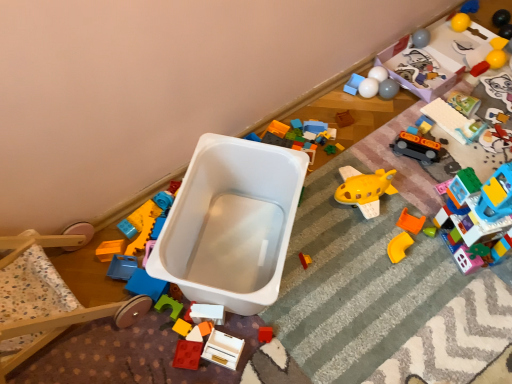
Question: From the image's perspective, is white plastic toy at center, the 14th toy when ordered from right to left, over rubberized plastic toy car at upper right, marked as the 4th toy in a right-to-left arrangement?

Choices:
 (A) yes
 (B) no

Answer: (B)

Question: Is white plastic toy at center, the 14th toy when ordered from right to left, shorter than rubberized plastic toy car at upper right, which appears as the thirteenth toy when viewed from the left?

Choices:
 (A) yes
 (B) no

Answer: (A)

Question: Can you confirm if white plastic toy at center, which is the third toy from left to right, is positioned to the right of rubberized plastic toy car at upper right, which appears as the thirteenth toy when viewed from the left?

Choices:
 (A) no
 (B) yes

Answer: (A)

Question: Can you confirm if white plastic toy at center, which is the third toy from left to right, is taller than rubberized plastic toy car at upper right, which appears as the thirteenth toy when viewed from the left?

Choices:
 (A) yes
 (B) no

Answer: (B)

Question: Is white plastic toy at center, the 14th toy when ordered from right to left, turned away from rubberized plastic toy car at upper right, which appears as the thirteenth toy when viewed from the left?

Choices:
 (A) no
 (B) yes

Answer: (A)

Question: Looking at their shapes, would you say rubberized plastic toy car at upper right, marked as the 4th toy in a right-to-left arrangement, is wider or thinner than rubberized plastic block at center, the 1th toy positioned from the left?

Choices:
 (A) thin
 (B) wide

Answer: (B)

Question: Does point click(440, 122) appear closer or farther from the camera than point click(181, 321)?

Choices:
 (A) closer
 (B) farther

Answer: (B)

Question: Is rubberized plastic toy car at upper right, marked as the 4th toy in a right-to-left arrangement, inside the boundaries of rubberized plastic block at center, the sixteenth toy from the right, or outside?

Choices:
 (A) outside
 (B) inside

Answer: (A)

Question: In terms of size, does rubberized plastic toy car at upper right, which appears as the thirteenth toy when viewed from the left, appear bigger or smaller than rubberized plastic block at center, the 1th toy positioned from the left?

Choices:
 (A) small
 (B) big

Answer: (B)

Question: Is point (330, 145) closer or farther from the camera than point (173, 329)?

Choices:
 (A) closer
 (B) farther

Answer: (B)

Question: From a real-world perspective, is green matte block at center, the sixth toy from the left, above or below rubberized plastic block at center, the 1th toy positioned from the left?

Choices:
 (A) above
 (B) below

Answer: (B)

Question: Is green matte block at center, the sixth toy from the left, in front of or behind rubberized plastic block at center, the sixteenth toy from the right, in the image?

Choices:
 (A) front
 (B) behind

Answer: (B)

Question: Considering the positions of green matte block at center, the 11th toy in the right-to-left sequence, and rubberized plastic block at center, the sixteenth toy from the right, in the image, is green matte block at center, the 11th toy in the right-to-left sequence, bigger or smaller than rubberized plastic block at center, the sixteenth toy from the right,?

Choices:
 (A) small
 (B) big

Answer: (A)

Question: Considering the positions of rubberized plastic block at center, the 1th toy positioned from the left, and rubberized plastic toy car at upper right, marked as the 4th toy in a right-to-left arrangement, in the image, is rubberized plastic block at center, the 1th toy positioned from the left, bigger or smaller than rubberized plastic toy car at upper right, marked as the 4th toy in a right-to-left arrangement,?

Choices:
 (A) big
 (B) small

Answer: (B)

Question: From a real-world perspective, is rubberized plastic block at center, the sixteenth toy from the right, positioned above or below rubberized plastic toy car at upper right, which appears as the thirteenth toy when viewed from the left?

Choices:
 (A) below
 (B) above

Answer: (A)